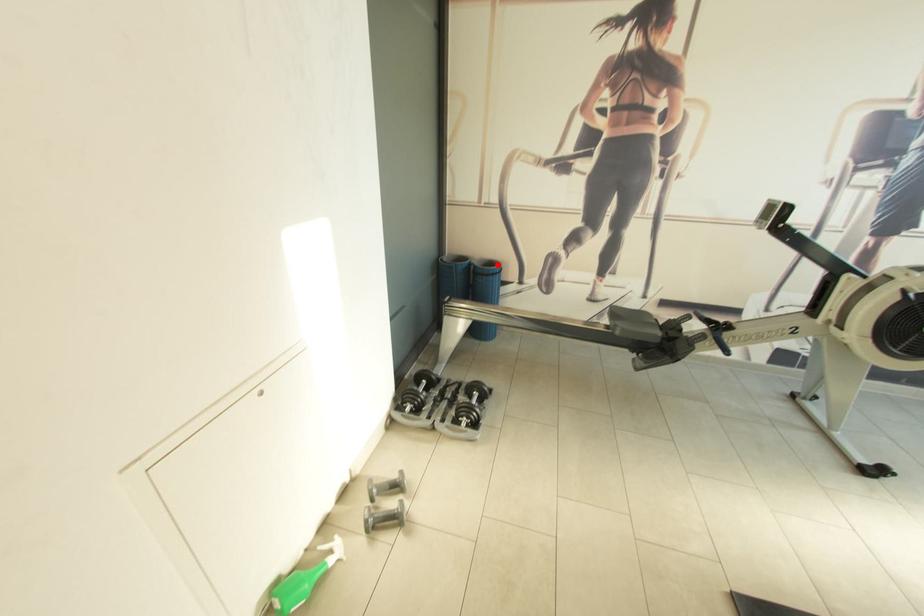
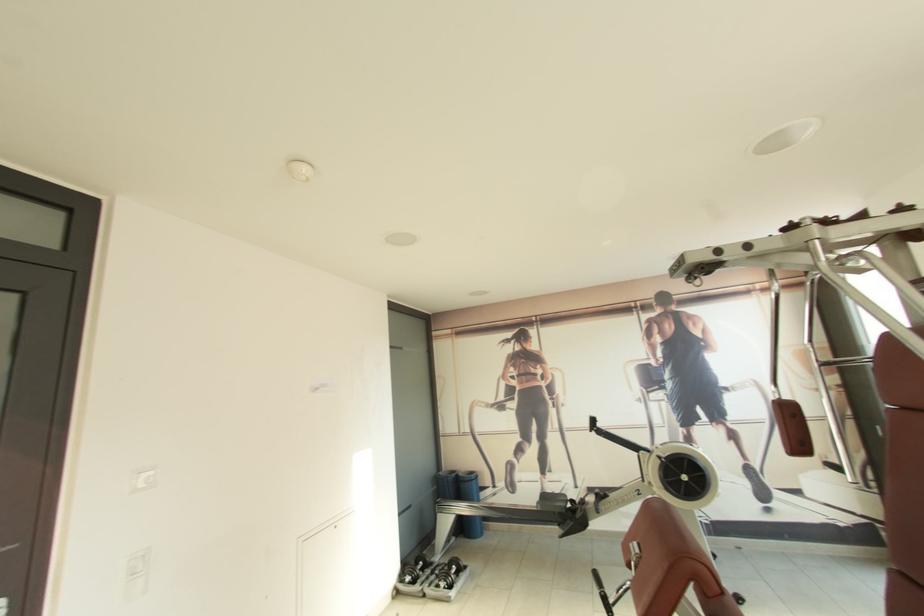
Question: I am providing you with two images of the same scene from different viewpoints. Given a red point in image1, look at the same physical point in image2. Is it:

Choices:
 (A) Closer to the viewpoint
 (B) Farther from the viewpoint

Answer: (B)